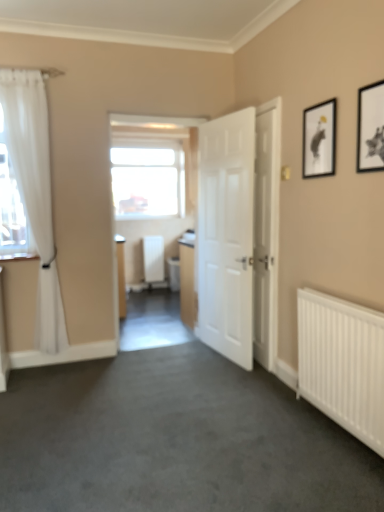
The height and width of the screenshot is (512, 384). Describe the element at coordinates (319, 140) in the screenshot. I see `black matte picture frame at upper right, the 2th picture frame in the front-to-back sequence` at that location.

Describe the element at coordinates (343, 362) in the screenshot. This screenshot has width=384, height=512. I see `white metal radiator at lower right, the 2th radiator from the left` at that location.

The height and width of the screenshot is (512, 384). Describe the element at coordinates (239, 234) in the screenshot. I see `white matte door at center, marked as the second door in a right-to-left arrangement` at that location.

The height and width of the screenshot is (512, 384). Describe the element at coordinates (153, 258) in the screenshot. I see `white matte radiator at center, the first radiator from the left` at that location.

Where is `white sheer curtain at left`? This screenshot has height=512, width=384. white sheer curtain at left is located at coordinates (35, 192).

Is white wooden door at right, the 1th door from the right, in front of or behind white metal radiator at lower right, arranged as the first radiator when viewed from the front, in the image?

white wooden door at right, the 1th door from the right, is behind white metal radiator at lower right, arranged as the first radiator when viewed from the front.

Considering the sizes of white wooden door at right, the 1th door from the right, and white metal radiator at lower right, marked as the 2th radiator in a back-to-front arrangement, in the image, is white wooden door at right, the 1th door from the right, bigger or smaller than white metal radiator at lower right, marked as the 2th radiator in a back-to-front arrangement,?

In the image, white wooden door at right, the 1th door from the right, appears to be smaller than white metal radiator at lower right, marked as the 2th radiator in a back-to-front arrangement.

Is point (257, 324) positioned behind point (346, 389)?

Yes.

In the image, is white wooden door at right, the 1th door from the right, on the left side or the right side of white metal radiator at lower right, marked as the 2th radiator in a back-to-front arrangement?

Clearly, white wooden door at right, the 1th door from the right, is on the left of white metal radiator at lower right, marked as the 2th radiator in a back-to-front arrangement, in the image.

Considering the relative positions of white wooden door at right, which is the 2th door from left to right, and transparent glass window at center in the image provided, is white wooden door at right, which is the 2th door from left to right, to the left or to the right of transparent glass window at center?

In the image, white wooden door at right, which is the 2th door from left to right, appears on the right side of transparent glass window at center.

How different are the orientations of white wooden door at right, the 1th door from the right, and transparent glass window at center in degrees?

The angular difference between white wooden door at right, the 1th door from the right, and transparent glass window at center is 90.6 degrees.

Which object is more forward, white wooden door at right, the 1th door from the right, or transparent glass window at center?

white wooden door at right, the 1th door from the right.

This screenshot has height=512, width=384. Find the location of `window on the left of white wooden door at right, the 1th door from the right`. window on the left of white wooden door at right, the 1th door from the right is located at coordinates (147, 178).

Does black matte picture frame at upper right, the 1th picture frame from the left, appear on the left side of white sheer curtain at left?

No.

Is point (328, 121) more distant than point (37, 189)?

No, it is in front of (37, 189).

From the image's perspective, would you say black matte picture frame at upper right, the 2th picture frame in the front-to-back sequence, is positioned over white sheer curtain at left?

Yes, from the image's perspective, black matte picture frame at upper right, the 2th picture frame in the front-to-back sequence, is above white sheer curtain at left.

Considering the sizes of objects black matte picture frame at upper right, the 2th picture frame in the front-to-back sequence, and white sheer curtain at left in the image provided, who is smaller, black matte picture frame at upper right, the 2th picture frame in the front-to-back sequence, or white sheer curtain at left?

Smaller between the two is black matte picture frame at upper right, the 2th picture frame in the front-to-back sequence.

Does white wooden door at right, the 1th door from the right, turn towards white sheer curtain at left?

No, white wooden door at right, the 1th door from the right, does not turn towards white sheer curtain at left.

Can you confirm if white wooden door at right, the 1th door from the right, is positioned to the left of white sheer curtain at left?

No.

Is white wooden door at right, the 1th door from the right, shorter than white sheer curtain at left?

Yes.

From the image's perspective, between white wooden door at right, which is the 2th door from left to right, and white sheer curtain at left, who is located below?

white wooden door at right, which is the 2th door from left to right, from the image's perspective.

Could you measure the distance between transparent glass window at center and white metal radiator at lower right, the 2th radiator from the left?

transparent glass window at center is 2.38 meters from white metal radiator at lower right, the 2th radiator from the left.

Visually, is transparent glass window at center positioned to the left or to the right of white metal radiator at lower right, marked as the 2th radiator in a back-to-front arrangement?

transparent glass window at center is to the left of white metal radiator at lower right, marked as the 2th radiator in a back-to-front arrangement.

Which of these two, transparent glass window at center or white metal radiator at lower right, which appears as the 1th radiator when viewed from the right, is smaller?

Smaller between the two is white metal radiator at lower right, which appears as the 1th radiator when viewed from the right.

Consider the image. Is transparent glass window at center wider or thinner than white metal radiator at lower right, which appears as the 1th radiator when viewed from the right?

Clearly, transparent glass window at center has less width compared to white metal radiator at lower right, which appears as the 1th radiator when viewed from the right.

Is white matte door at center, which is the first door from left to right, bigger than white matte radiator at center, the first radiator from the left?

Indeed, white matte door at center, which is the first door from left to right, has a larger size compared to white matte radiator at center, the first radiator from the left.

Consider the image. Considering the relative positions of white matte door at center, marked as the second door in a right-to-left arrangement, and white matte radiator at center, positioned as the 1th radiator in back-to-front order, in the image provided, is white matte door at center, marked as the second door in a right-to-left arrangement, to the right of white matte radiator at center, positioned as the 1th radiator in back-to-front order, from the viewer's perspective?

Indeed, white matte door at center, marked as the second door in a right-to-left arrangement, is positioned on the right side of white matte radiator at center, positioned as the 1th radiator in back-to-front order.

Is white matte radiator at center, the first radiator from the left, at the back of white matte door at center, marked as the second door in a right-to-left arrangement?

No, white matte door at center, marked as the second door in a right-to-left arrangement, is not facing away from white matte radiator at center, the first radiator from the left.

Consider the image. Is white sheer curtain at left touching black matte picture frame at upper right, the 1th picture frame from the back?

No, white sheer curtain at left is not with black matte picture frame at upper right, the 1th picture frame from the back.

Is white sheer curtain at left wider than black matte picture frame at upper right, the 1th picture frame from the back?

Yes.

From the image's perspective, does white sheer curtain at left appear higher than black matte picture frame at upper right, the 1th picture frame from the left?

No, from the image's perspective, white sheer curtain at left is not over black matte picture frame at upper right, the 1th picture frame from the left.

In the scene shown: Between white sheer curtain at left and black matte picture frame at upper right, the 2th picture frame in the front-to-back sequence, which one has smaller size?

black matte picture frame at upper right, the 2th picture frame in the front-to-back sequence.

Find the location of a particular element. The image size is (384, 512). radiator in front of the white wooden door at right, which is the 2th door from left to right is located at coordinates (343, 362).

Where is `window located above the white wooden door at right, the 1th door from the right (from the image's perspective)`? The width and height of the screenshot is (384, 512). window located above the white wooden door at right, the 1th door from the right (from the image's perspective) is located at coordinates (147, 178).

When comparing their distances from white matte door at center, marked as the second door in a right-to-left arrangement, does black matte picture frame at upper right, marked as the second picture frame in a left-to-right arrangement, or black matte picture frame at upper right, the 1th picture frame from the back, seem closer?

black matte picture frame at upper right, the 1th picture frame from the back, is positioned closer to the anchor white matte door at center, marked as the second door in a right-to-left arrangement.

Considering their positions, is white metal radiator at lower right, the 2th radiator from the left, positioned closer to black matte picture frame at upper right, the 1th picture frame from the back, than white sheer curtain at left?

white metal radiator at lower right, the 2th radiator from the left, is positioned closer to the anchor black matte picture frame at upper right, the 1th picture frame from the back.

When comparing their distances from white sheer curtain at left, does white wooden door at right, which is the 2th door from left to right, or black matte picture frame at upper right, arranged as the 2th picture frame when viewed from the right, seem further?

black matte picture frame at upper right, arranged as the 2th picture frame when viewed from the right, is further to white sheer curtain at left.

Estimate the real-world distances between objects in this image. Which object is closer to transparent glass window at center, black matte picture frame at upper right, the second picture frame positioned from the back, or white matte door at center, marked as the second door in a right-to-left arrangement?

Among the two, white matte door at center, marked as the second door in a right-to-left arrangement, is located nearer to transparent glass window at center.

Looking at the image, which one is located further to transparent glass window at center, white wooden door at right, which is the 2th door from left to right, or white metal radiator at lower right, arranged as the first radiator when viewed from the front?

white metal radiator at lower right, arranged as the first radiator when viewed from the front, is further to transparent glass window at center.

Based on the photo, estimate the real-world distances between objects in this image. Which object is closer to white matte radiator at center, positioned as the 1th radiator in back-to-front order, white matte door at center, marked as the second door in a right-to-left arrangement, or transparent glass window at center?

Based on the image, transparent glass window at center appears to be nearer to white matte radiator at center, positioned as the 1th radiator in back-to-front order.

Considering their positions, is white metal radiator at lower right, arranged as the first radiator when viewed from the front, positioned closer to white matte door at center, which is the first door from left to right, than white sheer curtain at left?

Based on the image, white metal radiator at lower right, arranged as the first radiator when viewed from the front, appears to be nearer to white matte door at center, which is the first door from left to right.

Which object lies nearer to the anchor point white metal radiator at lower right, marked as the 2th radiator in a back-to-front arrangement, black matte picture frame at upper right, arranged as the 2th picture frame when viewed from the right, or transparent glass window at center?

Among the two, black matte picture frame at upper right, arranged as the 2th picture frame when viewed from the right, is located nearer to white metal radiator at lower right, marked as the 2th radiator in a back-to-front arrangement.

Where is `door between black matte picture frame at upper right, the second picture frame positioned from the back, and white wooden door at right, which is the 2th door from left to right, along the z-axis`? The image size is (384, 512). door between black matte picture frame at upper right, the second picture frame positioned from the back, and white wooden door at right, which is the 2th door from left to right, along the z-axis is located at coordinates (239, 234).

Locate an element on the screen. picture frame located between white metal radiator at lower right, which appears as the 1th radiator when viewed from the right, and white matte radiator at center, the second radiator viewed from the right, in the depth direction is located at coordinates point(319,140).

Identify the location of picture frame between black matte picture frame at upper right, marked as the second picture frame in a left-to-right arrangement, and white matte radiator at center, the second radiator viewed from the right, in the front-back direction. Image resolution: width=384 pixels, height=512 pixels. (319, 140).

At what (x,y) coordinates should I click in order to perform the action: click on door positioned between black matte picture frame at upper right, the 2th picture frame in the front-to-back sequence, and white wooden door at right, the 1th door from the right, from near to far. Please return your answer as a coordinate pair (x, y). Looking at the image, I should click on (239, 234).